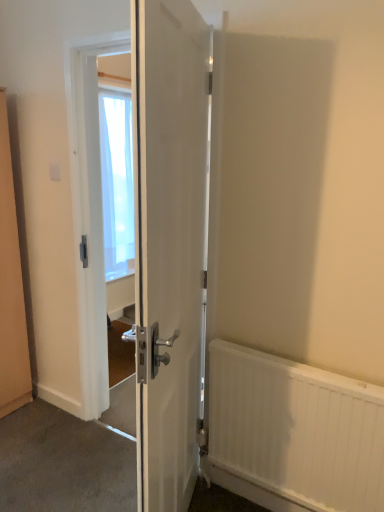
Question: Is white textured radiator at lower right placed right next to white plastic electric outlet at upper left?

Choices:
 (A) yes
 (B) no

Answer: (B)

Question: Would you say white textured radiator at lower right contains white plastic electric outlet at upper left?

Choices:
 (A) no
 (B) yes

Answer: (A)

Question: Can you confirm if white textured radiator at lower right is thinner than white plastic electric outlet at upper left?

Choices:
 (A) yes
 (B) no

Answer: (B)

Question: From the image's perspective, is white textured radiator at lower right located above white plastic electric outlet at upper left?

Choices:
 (A) yes
 (B) no

Answer: (B)

Question: Does white textured radiator at lower right lie behind white plastic electric outlet at upper left?

Choices:
 (A) no
 (B) yes

Answer: (A)

Question: Would you say white textured radiator at lower right is a long distance from white plastic electric outlet at upper left?

Choices:
 (A) yes
 (B) no

Answer: (A)

Question: Could you tell me if white textured radiator at lower right is facing white glossy door at center?

Choices:
 (A) no
 (B) yes

Answer: (A)

Question: Is the surface of white textured radiator at lower right in direct contact with white glossy door at center?

Choices:
 (A) no
 (B) yes

Answer: (A)

Question: Considering the relative positions of white textured radiator at lower right and white glossy door at center in the image provided, is white textured radiator at lower right to the right of white glossy door at center from the viewer's perspective?

Choices:
 (A) no
 (B) yes

Answer: (B)

Question: From a real-world perspective, is white textured radiator at lower right over white glossy door at center?

Choices:
 (A) no
 (B) yes

Answer: (A)

Question: Can you confirm if white textured radiator at lower right is shorter than white glossy door at center?

Choices:
 (A) no
 (B) yes

Answer: (B)

Question: Can you confirm if white textured radiator at lower right is thinner than white glossy door at center?

Choices:
 (A) no
 (B) yes

Answer: (B)

Question: Could you tell me if white plastic electric outlet at upper left is facing white textured radiator at lower right?

Choices:
 (A) yes
 (B) no

Answer: (B)